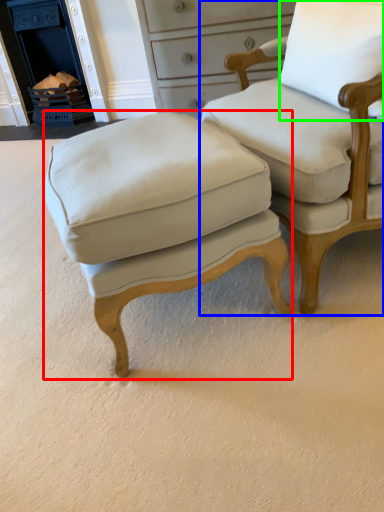
Question: Considering the real-world distances, which object is closest to stool (highlighted by a red box)? chair (highlighted by a blue box) or pillow (highlighted by a green box).

Choices:
 (A) chair
 (B) pillow

Answer: (A)